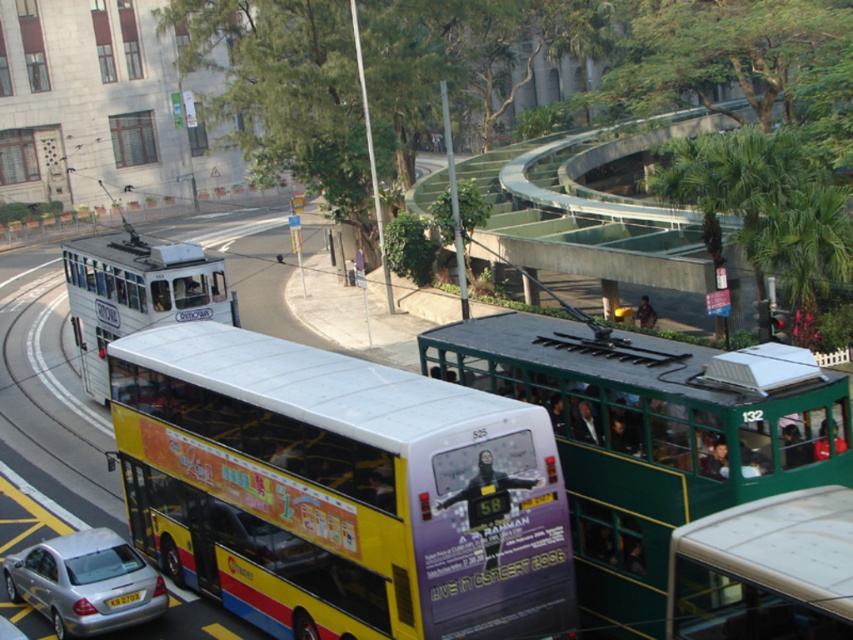
Question: Does silver metallic car at lower left appear on the left side of black plastic license plate at lower center?

Choices:
 (A) yes
 (B) no

Answer: (A)

Question: Which point appears closest to the camera in this image?

Choices:
 (A) (32, 556)
 (B) (515, 636)
 (C) (108, 332)

Answer: (B)

Question: Is yellow painted decker bus at center to the left of silver metallic car at lower left from the viewer's perspective?

Choices:
 (A) yes
 (B) no

Answer: (B)

Question: Does yellow painted decker bus at center appear over silver metallic car at lower left?

Choices:
 (A) yes
 (B) no

Answer: (A)

Question: Estimate the real-world distances between objects in this image. Which object is closer to the yellow painted decker bus at center?

Choices:
 (A) green metallic tram at center
 (B) black plastic license plate at lower center
 (C) white matte trolleybus at left
 (D) silver metallic car at lower left

Answer: (D)

Question: Which object is positioned farthest from the white matte trolleybus at left?

Choices:
 (A) silver metallic car at lower left
 (B) yellow painted decker bus at center
 (C) green metallic tram at center
 (D) black plastic license plate at lower center

Answer: (C)